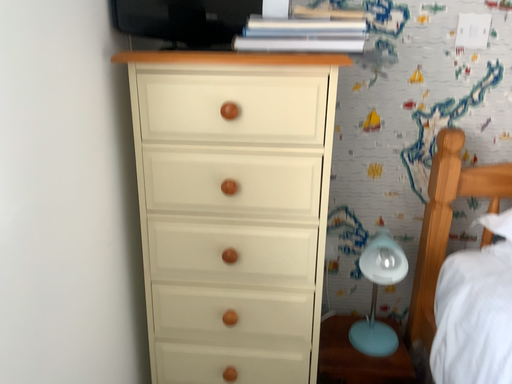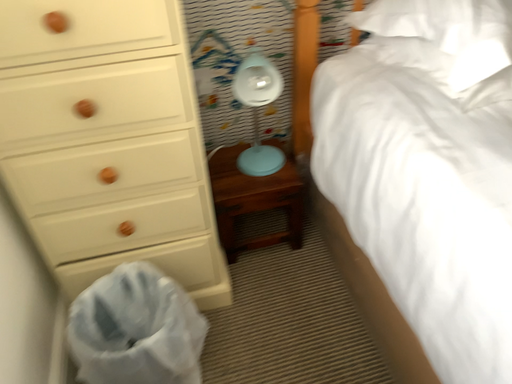
Question: How did the camera likely rotate when shooting the video?

Choices:
 (A) rotated right
 (B) rotated left

Answer: (A)